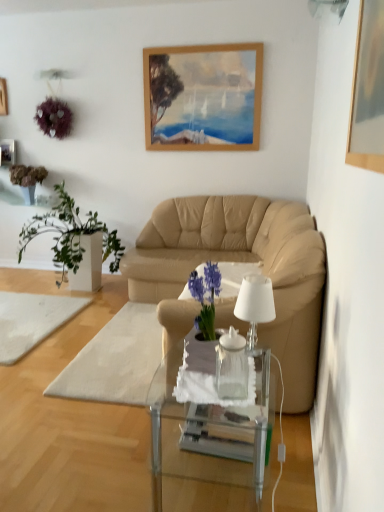
You are a GUI agent. You are given a task and a screenshot of the screen. Output one action in this format:
    pyautogui.click(x=<x>, y=<y>)
    Task: Click on the wooden picture frame at upper right, placed as the 3th picture frame when sorted from left to right
    This screenshot has height=512, width=384.
    Given the screenshot: What is the action you would take?
    pyautogui.click(x=368, y=91)

Describe the element at coordinates (255, 305) in the screenshot. The width and height of the screenshot is (384, 512). I see `white glass lamp at center` at that location.

This screenshot has height=512, width=384. What do you see at coordinates (3, 97) in the screenshot? I see `wooden picture frame at upper left, the 1th picture frame when ordered from top to bottom` at bounding box center [3, 97].

From the picture: Measure the distance between point [121,391] and camera.

The depth of point [121,391] is 2.40 meters.

You are a GUI agent. You are given a task and a screenshot of the screen. Output one action in this format:
    pyautogui.click(x=<x>, y=<y>)
    Task: Click on the white fabric footrest at center
    
    Given the screenshot: What is the action you would take?
    pyautogui.click(x=115, y=360)

In order to face white rug at lower left, should I rotate leftwards or rightwards?

You should look left and rotate roughly 23.696 degrees.

Where is `metallic silver picture frame at upper left, which is counted as the 2th picture frame, starting from the top`? This screenshot has height=512, width=384. metallic silver picture frame at upper left, which is counted as the 2th picture frame, starting from the top is located at coordinates point(8,152).

From the image's perspective, is white fabric footrest at center under green leafy plant at upper left, marked as the second houseplant in a right-to-left arrangement?

Indeed, from the image's perspective, white fabric footrest at center is shown beneath green leafy plant at upper left, marked as the second houseplant in a right-to-left arrangement.

Can you confirm if white fabric footrest at center is positioned to the left of green leafy plant at upper left, positioned as the 1th houseplant in left-to-right order?

In fact, white fabric footrest at center is to the right of green leafy plant at upper left, positioned as the 1th houseplant in left-to-right order.

Considering the sizes of objects white fabric footrest at center and green leafy plant at upper left, positioned as the 1th houseplant in left-to-right order, in the image provided, who is wider, white fabric footrest at center or green leafy plant at upper left, positioned as the 1th houseplant in left-to-right order,?

With larger width is white fabric footrest at center.

From a real-world perspective, is green leafy plant at left, which appears as the 1th houseplant when viewed from the right, positioned over beige leather couch at center based on gravity?

Yes, from a real-world perspective, green leafy plant at left, which appears as the 1th houseplant when viewed from the right, is over beige leather couch at center

Considering the sizes of green leafy plant at left, which appears as the 1th houseplant when viewed from the right, and beige leather couch at center in the image, is green leafy plant at left, which appears as the 1th houseplant when viewed from the right, wider or thinner than beige leather couch at center?

Considering their sizes, green leafy plant at left, which appears as the 1th houseplant when viewed from the right, looks slimmer than beige leather couch at center.

Is point (55, 222) positioned in front of point (199, 234)?

No, it is not.

Which object is positioned more to the left, green leafy plant at left, which appears as the 1th houseplant when viewed from the right, or beige leather couch at center?

Positioned to the left is green leafy plant at left, which appears as the 1th houseplant when viewed from the right.

Does white fabric footrest at center contain white rug at lower left?

No, white rug at lower left is not surrounded by white fabric footrest at center.

Which object is further away from the camera, white fabric footrest at center or white rug at lower left?

white rug at lower left.

How many degrees apart are the facing directions of white fabric footrest at center and white rug at lower left?

87.7 degrees.

Which object is positioned more to the right, white fabric footrest at center or white rug at lower left?

white fabric footrest at center.

Is point (11, 338) closer to camera compared to point (65, 224)?

Yes, point (11, 338) is in front of point (65, 224).

What's the angular difference between white rug at lower left and green leafy plant at left, which appears as the second houseplant when viewed from the left,'s facing directions?

There is a 2.14-degree angle between the facing directions of white rug at lower left and green leafy plant at left, which appears as the second houseplant when viewed from the left.

Considering the sizes of objects white rug at lower left and green leafy plant at left, which appears as the 1th houseplant when viewed from the right, in the image provided, who is shorter, white rug at lower left or green leafy plant at left, which appears as the 1th houseplant when viewed from the right,?

white rug at lower left is shorter.

Is metallic silver picture frame at upper left, which is the 2th picture frame in left-to-right order, closer to camera compared to white fabric footrest at center?

No, the depth of metallic silver picture frame at upper left, which is the 2th picture frame in left-to-right order, is greater than that of white fabric footrest at center.

The height and width of the screenshot is (512, 384). Find the location of `footrest below the metallic silver picture frame at upper left, the second picture frame from the bottom (from a real-world perspective)`. footrest below the metallic silver picture frame at upper left, the second picture frame from the bottom (from a real-world perspective) is located at coordinates (115, 360).

Does metallic silver picture frame at upper left, which is the 2th picture frame in left-to-right order, have a smaller size compared to white fabric footrest at center?

Correct, metallic silver picture frame at upper left, which is the 2th picture frame in left-to-right order, occupies less space than white fabric footrest at center.

From a real-world perspective, who is located higher, metallic silver picture frame at upper left, placed as the 2th picture frame when sorted from right to left, or white fabric footrest at center?

metallic silver picture frame at upper left, placed as the 2th picture frame when sorted from right to left, is physically above.

Considering the relative sizes of white rug at lower left and wooden picture frame at upper right, the 3th picture frame from the back, in the image provided, is white rug at lower left bigger than wooden picture frame at upper right, the 3th picture frame from the back,?

Indeed, white rug at lower left has a larger size compared to wooden picture frame at upper right, the 3th picture frame from the back.

Does point (12, 297) come farther from viewer compared to point (365, 114)?

Yes, it is.

From the image's perspective, is white rug at lower left above or below wooden picture frame at upper right, acting as the first picture frame starting from the front?

white rug at lower left is situated lower than wooden picture frame at upper right, acting as the first picture frame starting from the front, in the image.

Does white rug at lower left have a greater width compared to wooden picture frame at upper right, acting as the third picture frame starting from the top?

Indeed, white rug at lower left has a greater width compared to wooden picture frame at upper right, acting as the third picture frame starting from the top.

At what (x,y) coordinates should I click in order to perform the action: click on the 2nd picture frame located above the transparent glass coffee table at center (from a real-world perspective). Please return your answer as a coordinate pair (x, y). The width and height of the screenshot is (384, 512). Looking at the image, I should click on (368, 91).

Can you tell me how much transparent glass coffee table at center and wooden picture frame at upper right, the 3th picture frame from the back, differ in facing direction?

The angle between the facing direction of transparent glass coffee table at center and the facing direction of wooden picture frame at upper right, the 3th picture frame from the back, is 2.46 degrees.

Considering the positions of points (243, 420) and (382, 152), is point (243, 420) farther from camera compared to point (382, 152)?

Yes.

Identify the location of the footrest located below the green leafy plant at upper left, positioned as the 1th houseplant in left-to-right order (from the image's perspective). The image size is (384, 512). (115, 360).

Locate an element on the screen. the 1st houseplant positioned above the beige leather couch at center (from a real-world perspective) is located at coordinates (70, 234).

Which object lies nearer to the anchor point white rug at lower left, wooden picture frame at upper left, the second picture frame from the back, or white fabric footrest at center?

white fabric footrest at center is closer to white rug at lower left.

When comparing their distances from white rug at lower left, does metallic silver picture frame at upper left, which is counted as the 2th picture frame, starting from the top, or wooden picture frame at upper right, the 3th picture frame from the back, seem closer?

Based on the image, metallic silver picture frame at upper left, which is counted as the 2th picture frame, starting from the top, appears to be nearer to white rug at lower left.

Looking at the image, which one is located closer to wooden picture frame at upper right, which is the 1th picture frame from right to left, green leafy plant at left, which appears as the second houseplant when viewed from the left, or transparent glass coffee table at center?

transparent glass coffee table at center lies closer to wooden picture frame at upper right, which is the 1th picture frame from right to left, than the other object.

From the image, which object appears to be farther from green leafy plant at upper left, marked as the second houseplant in a right-to-left arrangement, white rug at lower left or transparent glass coffee table at center?

The object further to green leafy plant at upper left, marked as the second houseplant in a right-to-left arrangement, is transparent glass coffee table at center.

Looking at the image, which one is located further to wooden picture frame at upper left, the second picture frame from the back, transparent glass coffee table at center or green leafy plant at upper left, marked as the second houseplant in a right-to-left arrangement?

transparent glass coffee table at center.

Which object lies nearer to the anchor point white rug at lower left, green leafy plant at left, which appears as the second houseplant when viewed from the left, or wooden picture frame at upper left, arranged as the 1th picture frame when viewed from the left?

green leafy plant at left, which appears as the second houseplant when viewed from the left, is closer to white rug at lower left.

Which object lies further to the anchor point white glass lamp at center, beige leather couch at center or metallic silver picture frame at upper left, which is the 2th picture frame in left-to-right order?

metallic silver picture frame at upper left, which is the 2th picture frame in left-to-right order, lies further to white glass lamp at center than the other object.

Estimate the real-world distances between objects in this image. Which object is further from wooden picture frame at upper right, acting as the third picture frame starting from the top, metallic silver picture frame at upper left, placed as the 2th picture frame when sorted from right to left, or green leafy plant at upper left, positioned as the 1th houseplant in left-to-right order?

The object further to wooden picture frame at upper right, acting as the third picture frame starting from the top, is metallic silver picture frame at upper left, placed as the 2th picture frame when sorted from right to left.

This screenshot has width=384, height=512. I want to click on coffee table between wooden picture frame at upper right, placed as the 3th picture frame when sorted from left to right, and wooden picture frame at upper left, the second picture frame from the back, in the front-back direction, so pyautogui.click(x=209, y=434).

At what (x,y) coordinates should I click in order to perform the action: click on studio couch between white glass lamp at center and wooden picture frame at upper left, arranged as the 1th picture frame when viewed from the left, along the z-axis. Please return your answer as a coordinate pair (x, y). This screenshot has width=384, height=512. Looking at the image, I should click on (236, 262).

What are the coordinates of `the footrest positioned between white glass lamp at center and green leafy plant at left, which appears as the 1th houseplant when viewed from the right, from near to far` in the screenshot? It's located at (115, 360).

Identify the location of picture frame positioned between wooden picture frame at upper right, which is the 1th picture frame from right to left, and metallic silver picture frame at upper left, placed as the 2th picture frame when sorted from right to left, from near to far. 3,97.